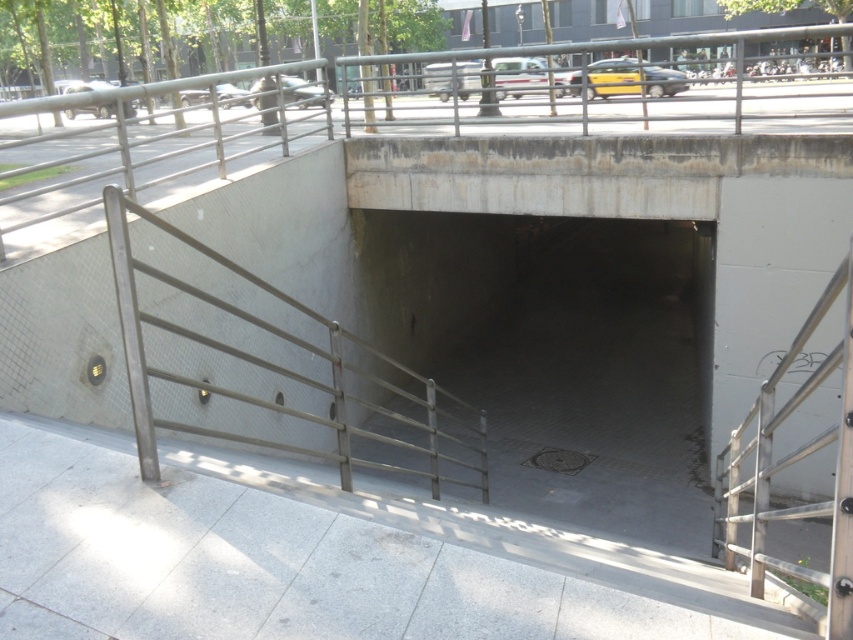
Does concrete tunnel at center come behind metallic gray railing at center?

Yes, it is behind metallic gray railing at center.

Is point (401, 262) closer to viewer compared to point (132, 209)?

No, (401, 262) is further to viewer.

Image resolution: width=853 pixels, height=640 pixels. Find the location of `concrete tunnel at center`. concrete tunnel at center is located at coordinates (556, 355).

Between point (589, 412) and point (784, 572), which one is positioned in front?

Point (784, 572)

Which is above, concrete tunnel at center or metallic silver railing at right?

concrete tunnel at center

Is point (363, 266) positioned in front of point (845, 506)?

That is False.

You are a GUI agent. You are given a task and a screenshot of the screen. Output one action in this format:
    pyautogui.click(x=<x>, y=<y>)
    Task: Click on the concrete tunnel at center
    The width and height of the screenshot is (853, 640).
    Given the screenshot: What is the action you would take?
    pyautogui.click(x=556, y=355)

Is the position of white tile pavement at lower center less distant than that of metallic gray railing at center?

That is True.

Looking at this image, is white tile pavement at lower center shorter than metallic gray railing at center?

Yes.

I want to click on white tile pavement at lower center, so click(x=318, y=557).